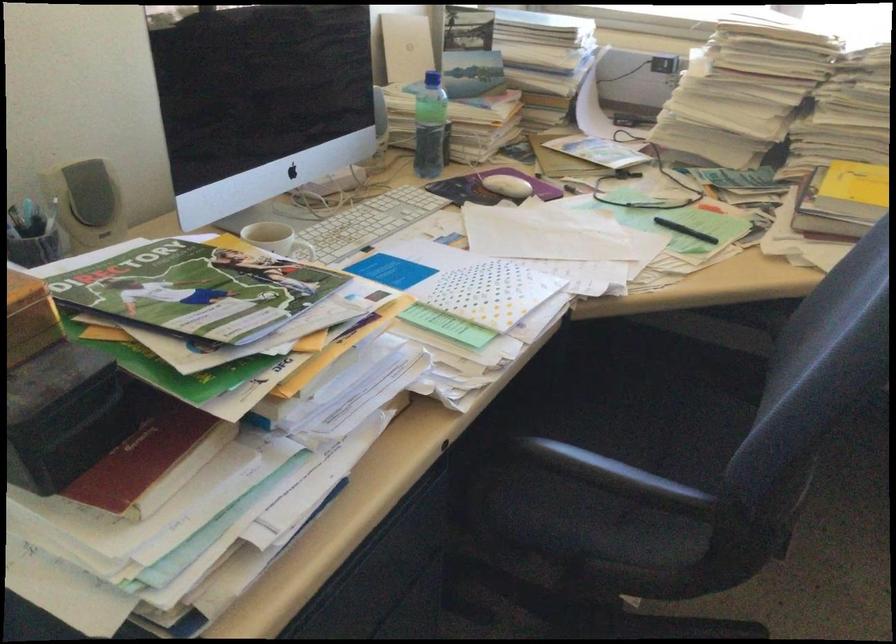
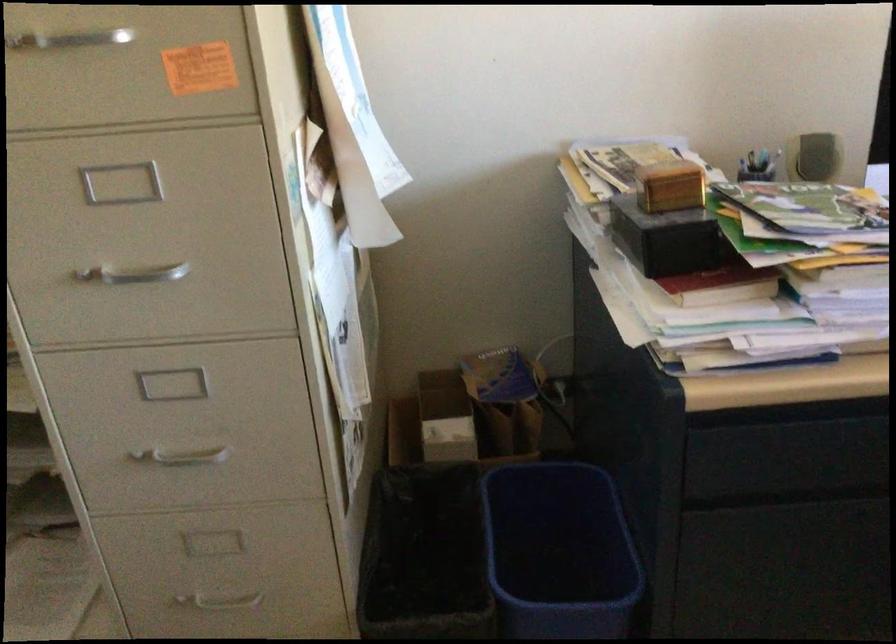
Question: The first image is from the beginning of the video and the second image is from the end. How did the camera likely rotate when shooting the video?

Choices:
 (A) Left
 (B) Right
 (C) Up
 (D) Down

Answer: (A)